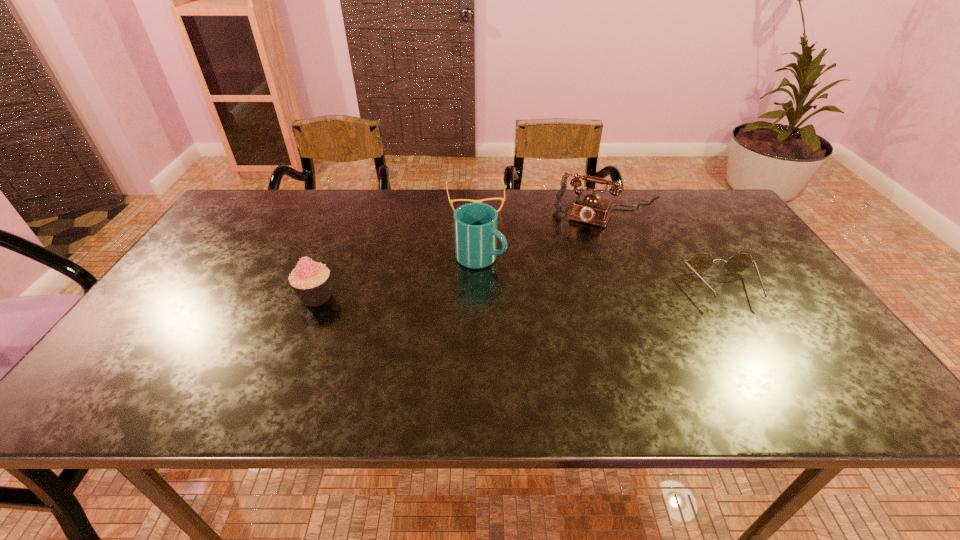
Identify the location of cupcake. The width and height of the screenshot is (960, 540). (310, 280).

The width and height of the screenshot is (960, 540). In order to click on the fourth tallest object in this screenshot , I will do `click(701, 262)`.

Identify the location of the right spectacles. (701, 262).

This screenshot has height=540, width=960. I want to click on the third nearest object, so click(475, 224).

Where is `telephone`? telephone is located at coordinates (590, 208).

Where is `the farther spectacles`? the farther spectacles is located at coordinates (503, 199).

At what (x,y) coordinates should I click in order to perform the action: click on the shorter spectacles. Please return your answer as a coordinate pair (x, y). Looking at the image, I should click on (503, 199).

This screenshot has height=540, width=960. In order to click on vacant space located 0.140m on the back of the cupcake in this screenshot , I will do `click(335, 251)`.

What are the coordinates of `vacant space located on the front-facing side of the taller spectacles` in the screenshot? It's located at (755, 338).

This screenshot has height=540, width=960. Identify the location of vacant space located 0.270m on the handle side of the cup. (596, 301).